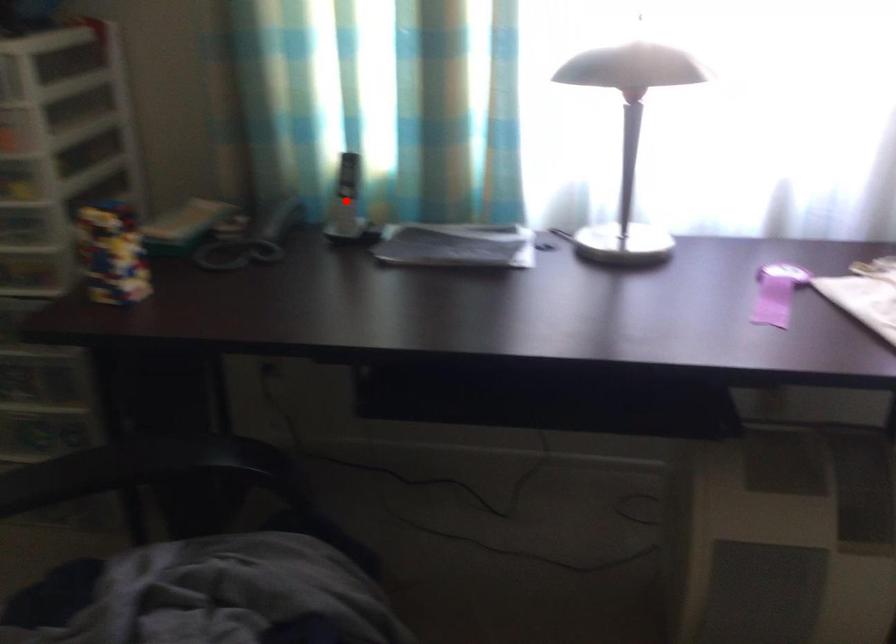
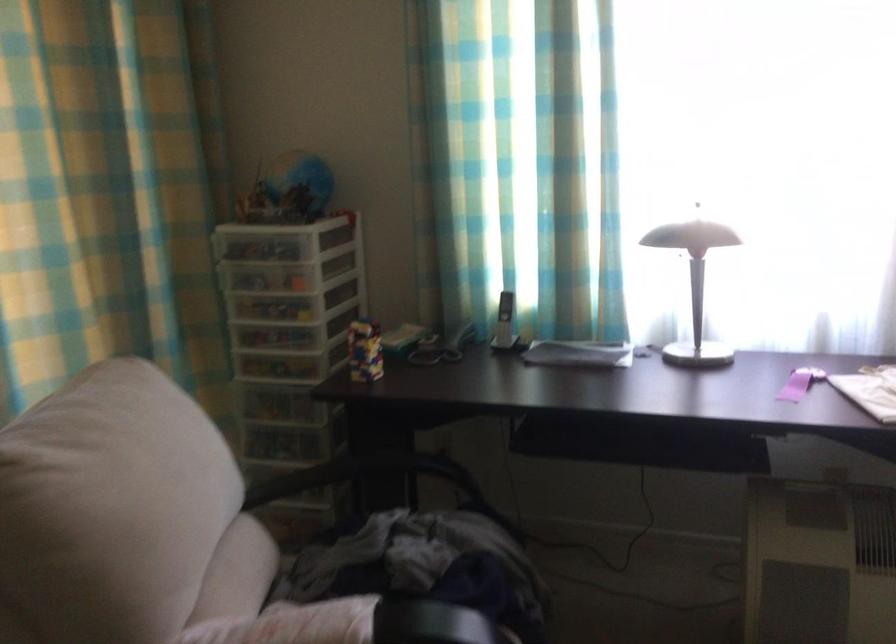
Where in the second image is the point corresponding to the highlighted location from the first image?

(504, 322)